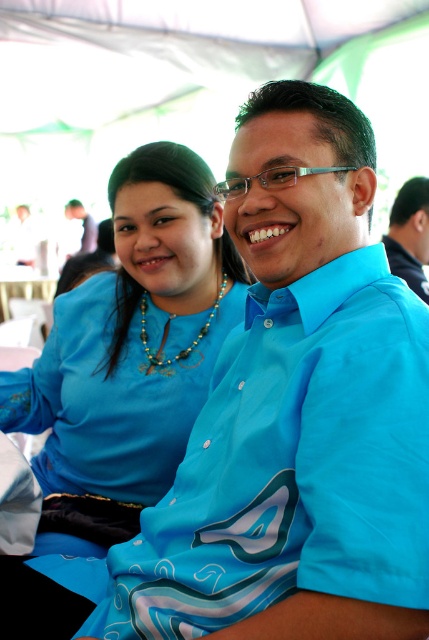
Measure the distance between matte blue blouse at left and camera.

4.47 feet

Does matte blue blouse at left have a lesser width compared to blue fabric shirt at center?

Incorrect, matte blue blouse at left's width is not less than blue fabric shirt at center's.

Does point (223, 333) lie behind point (407, 230)?

That is False.

Find the location of a particular element. The width and height of the screenshot is (429, 640). matte blue blouse at left is located at coordinates (130, 352).

Between point (103, 458) and point (75, 209), which one is positioned behind?

Positioned behind is point (75, 209).

Does matte blue blouse at left appear under matte black shirt at upper left?

Correct, matte blue blouse at left is located below matte black shirt at upper left.

Which is in front, point (47, 493) or point (91, 240)?

Point (47, 493) is in front.

Locate an element on the screen. Image resolution: width=429 pixels, height=640 pixels. matte blue blouse at left is located at coordinates (130, 352).

Describe the element at coordinates (410, 234) in the screenshot. I see `blue fabric shirt at center` at that location.

Is point (410, 211) farther from viewer compared to point (91, 237)?

That is False.

Find the location of a particular element. blue fabric shirt at center is located at coordinates (410, 234).

This screenshot has height=640, width=429. Identify the location of blue fabric shirt at center. (410, 234).